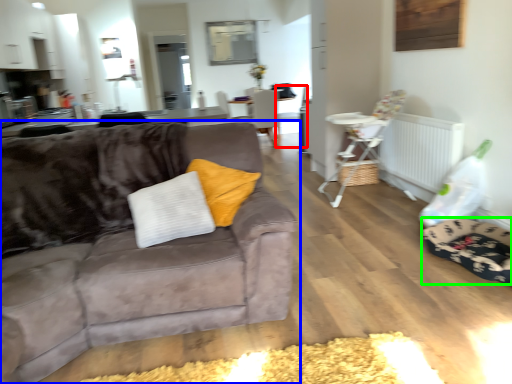
Question: Based on their relative distances, which object is farther from armchair (highlighted by a red box)? Choose from studio couch (highlighted by a blue box) and dog bed (highlighted by a green box).

Choices:
 (A) studio couch
 (B) dog bed

Answer: (A)